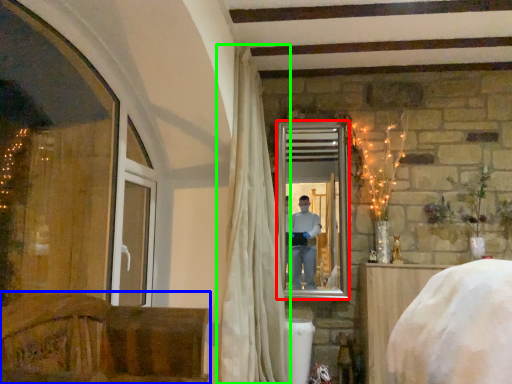
Question: Estimate the real-world distances between objects in this image. Which object is closer to mirror (highlighted by a red box), furniture (highlighted by a blue box) or curtain (highlighted by a green box)?

Choices:
 (A) furniture
 (B) curtain

Answer: (B)